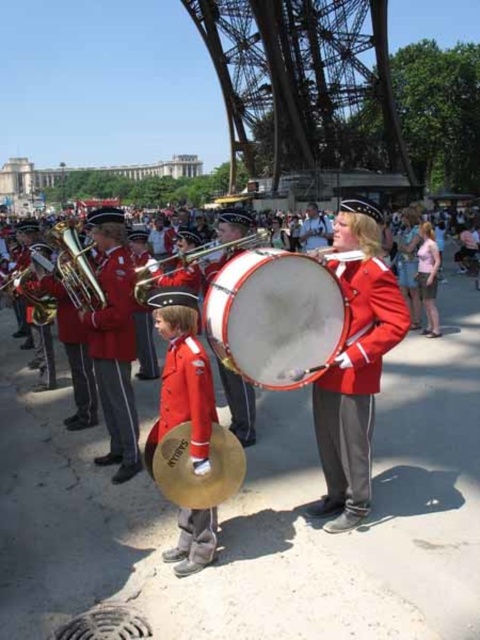
You are a photographer trying to capture the entire marching band and the Eiffel Tower in one shot. You notice the shiny brass drum at center and the brass cymbal at center. Which object should you focus on to ensure both the band and the tower are in frame?

The shiny brass drum at center is larger than the brass cymbal at center, so focusing on the shiny brass drum at center would help ensure the entire scene including the band and the Eiffel Tower is captured in the frame.